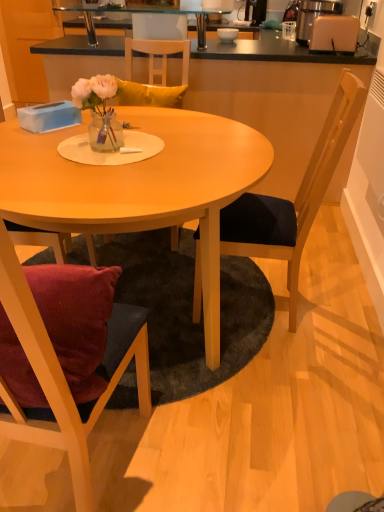
Question: Is wooden chair at upper center surrounding beige plastic toaster at upper right?

Choices:
 (A) yes
 (B) no

Answer: (B)

Question: Can you confirm if wooden chair at upper center is smaller than beige plastic toaster at upper right?

Choices:
 (A) yes
 (B) no

Answer: (A)

Question: Could you tell me if wooden chair at upper center is facing beige plastic toaster at upper right?

Choices:
 (A) no
 (B) yes

Answer: (A)

Question: From the image's perspective, is wooden chair at upper center below beige plastic toaster at upper right?

Choices:
 (A) no
 (B) yes

Answer: (B)

Question: Can you confirm if wooden chair at upper center is thinner than beige plastic toaster at upper right?

Choices:
 (A) no
 (B) yes

Answer: (B)

Question: Is wooden chair at upper center outside beige plastic toaster at upper right?

Choices:
 (A) no
 (B) yes

Answer: (B)

Question: Does wooden chair at upper center have a smaller size compared to white plastic toaster at upper right?

Choices:
 (A) yes
 (B) no

Answer: (A)

Question: Considering the relative sizes of wooden chair at upper center and white plastic toaster at upper right in the image provided, is wooden chair at upper center bigger than white plastic toaster at upper right?

Choices:
 (A) no
 (B) yes

Answer: (A)

Question: Can you see wooden chair at upper center touching white plastic toaster at upper right?

Choices:
 (A) yes
 (B) no

Answer: (B)

Question: Are wooden chair at upper center and white plastic toaster at upper right located far from each other?

Choices:
 (A) no
 (B) yes

Answer: (A)

Question: Can you confirm if wooden chair at upper center is shorter than white plastic toaster at upper right?

Choices:
 (A) yes
 (B) no

Answer: (B)

Question: From the image's perspective, would you say wooden chair at upper center is positioned over white plastic toaster at upper right?

Choices:
 (A) yes
 (B) no

Answer: (A)

Question: Does beige plastic toaster at upper right have a larger size compared to matte white bowl at upper center?

Choices:
 (A) no
 (B) yes

Answer: (B)